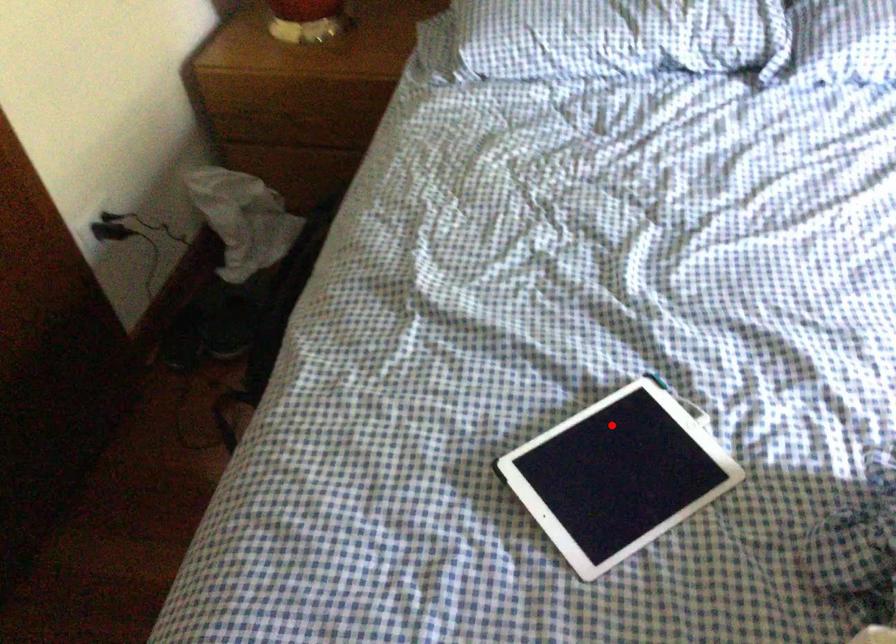
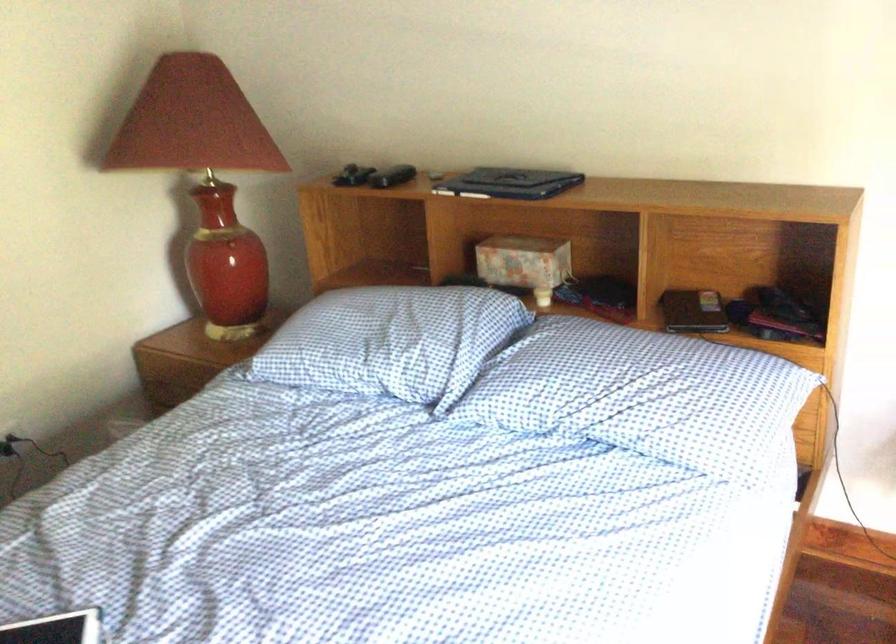
Question: I am providing you with two images of the same scene from different viewpoints. Image1 has a red point marked. In image2, the corresponding 3D location appears at what relative position? Reply with the corresponding letter.

Choices:
 (A) Closer
 (B) Farther

Answer: (B)